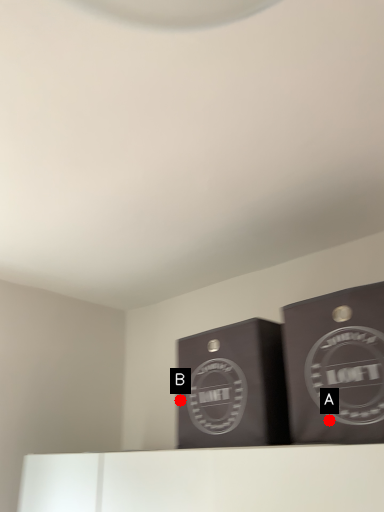
Question: Two points are circled on the image, labeled by A and B beside each circle. Among these points, which one is nearest to the camera?

Choices:
 (A) A is closer
 (B) B is closer

Answer: (A)